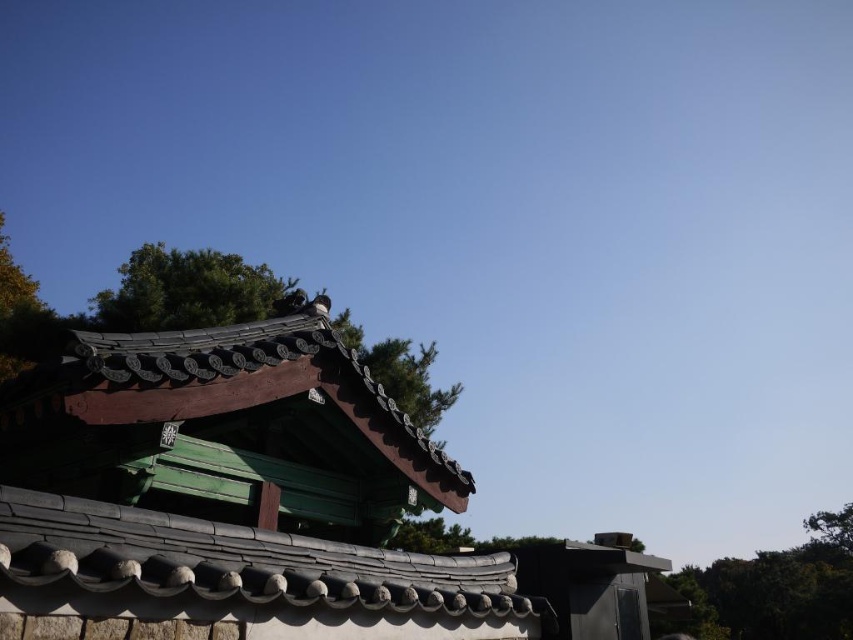
Is point (288, 442) farther from camera compared to point (668, 580)?

No.

Is point (277, 332) farther from camera compared to point (799, 616)?

That is False.

At what (x,y) coordinates should I click in order to perform the action: click on shiny dark green roof at left. Please return your answer as a coordinate pair (x, y). Looking at the image, I should click on (225, 426).

Does green leafy tree at upper left have a greater width compared to green textured tree at center?

Indeed, green leafy tree at upper left has a greater width compared to green textured tree at center.

Is green leafy tree at upper left thinner than green textured tree at center?

Incorrect, green leafy tree at upper left's width is not less than green textured tree at center's.

Where is `green leafy tree at upper left`? green leafy tree at upper left is located at coordinates (776, 588).

Is shiny dark green roof at left positioned behind green textured tree at center?

No, shiny dark green roof at left is in front of green textured tree at center.

Which is behind, point (245, 458) or point (410, 522)?

The point (410, 522) is behind.

Which is in front, point (151, 499) or point (442, 525)?

Point (151, 499) is more forward.

Where is `shiny dark green roof at left`? shiny dark green roof at left is located at coordinates (225, 426).